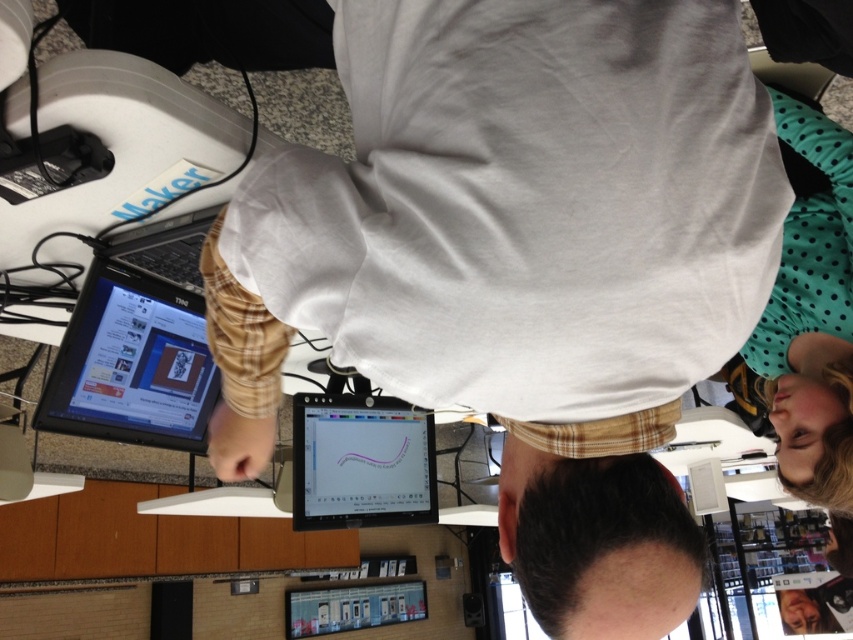
Question: Does black glossy tablet at left appear under smooth skin face at lower right?

Choices:
 (A) yes
 (B) no

Answer: (B)

Question: Which of the following is the farthest from the observer?

Choices:
 (A) (843, 630)
 (B) (363, 500)

Answer: (A)

Question: Among these points, which one is nearest to the camera?

Choices:
 (A) (146, 282)
 (B) (361, 438)
 (C) (485, 339)
 (D) (842, 595)

Answer: (C)

Question: Is black plastic laptop at upper left above smooth skin face at lower right?

Choices:
 (A) yes
 (B) no

Answer: (A)

Question: Is white cotton shirt at center above black plastic laptop at upper left?

Choices:
 (A) yes
 (B) no

Answer: (B)

Question: Considering the real-world distances, which object is farthest from the matte plastic tablet at center?

Choices:
 (A) white cotton shirt at center
 (B) black plastic laptop at upper left

Answer: (A)